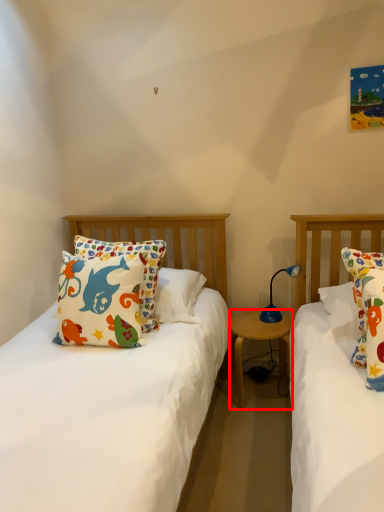
Question: From the image's perspective, where is nightstand (annotated by the red box) located in relation to lamp in the image?

Choices:
 (A) below
 (B) above

Answer: (A)